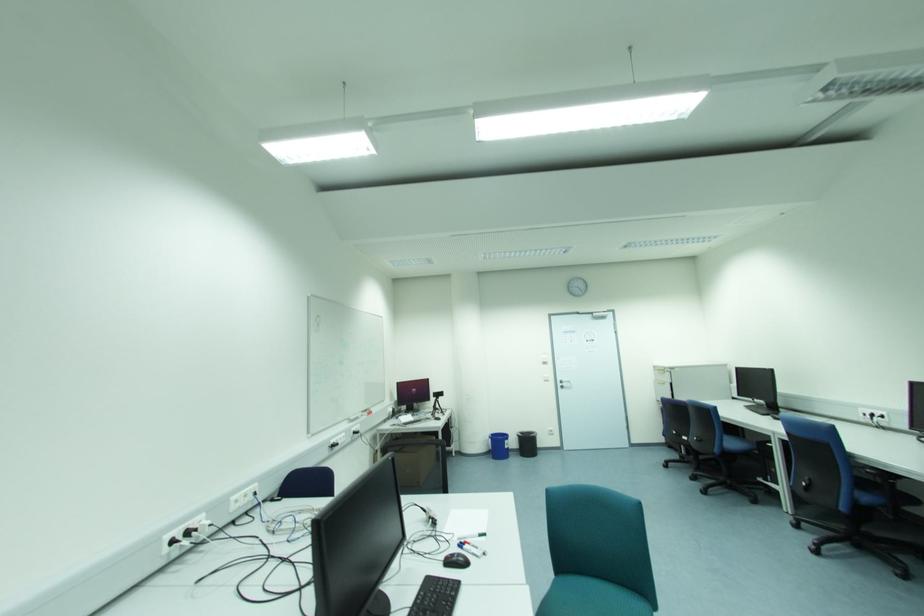
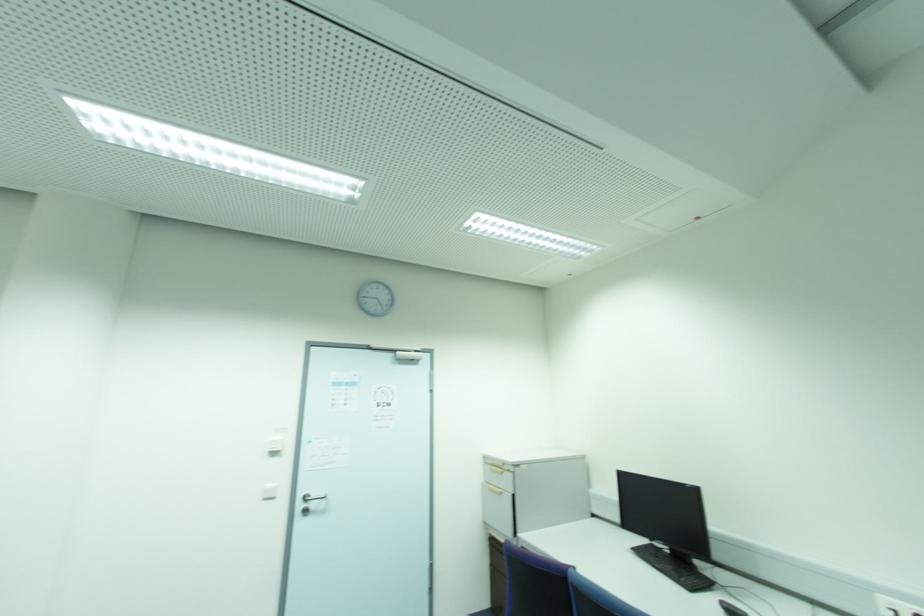
Where in the second image is the point corresponding to [664,383] from the first image?

(502, 493)